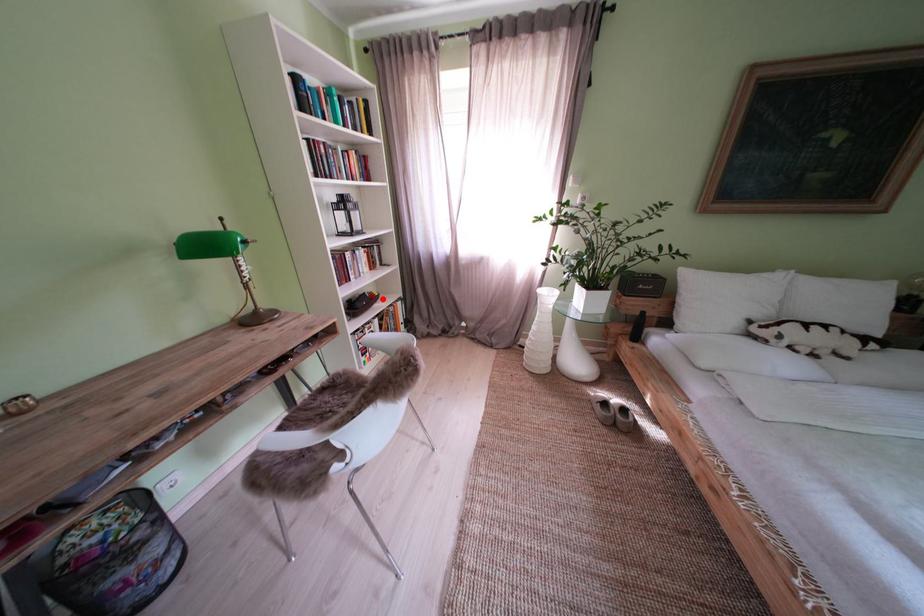
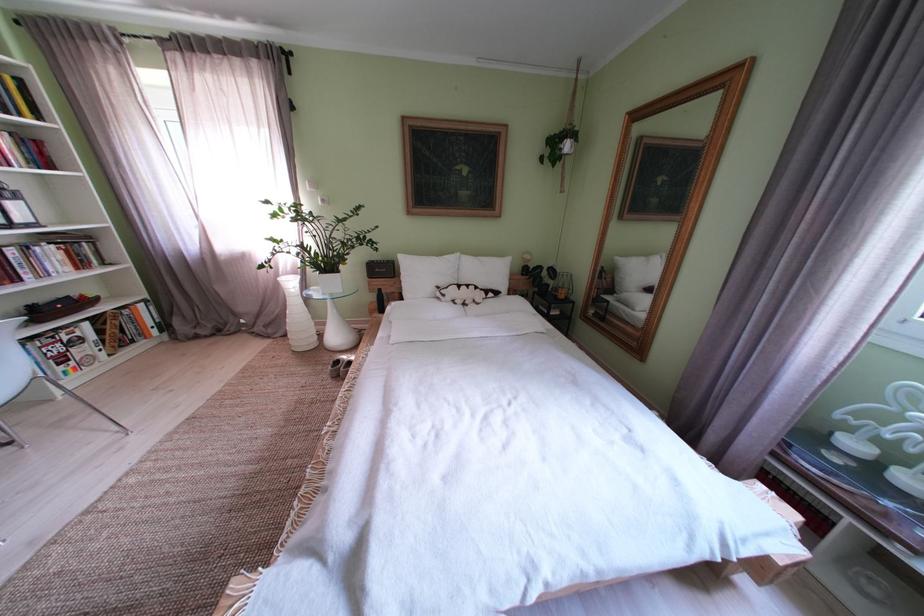
Question: I am providing you with two images of the same scene from different viewpoints. A red point is shown in image1. For the corresponding object point in image2, is it positioned nearer or farther from the camera?

Choices:
 (A) Nearer
 (B) Farther

Answer: (B)